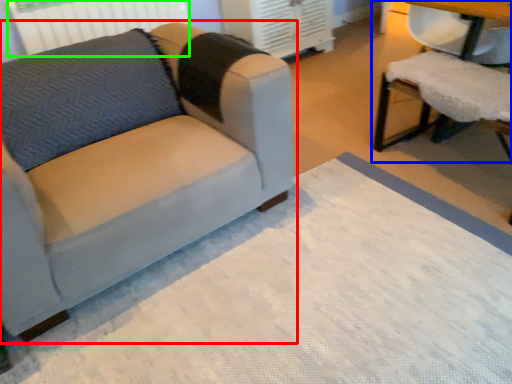
Question: Which is nearer to the studio couch (highlighted by a red box)? chair (highlighted by a blue box) or radiator (highlighted by a green box).

Choices:
 (A) chair
 (B) radiator

Answer: (A)